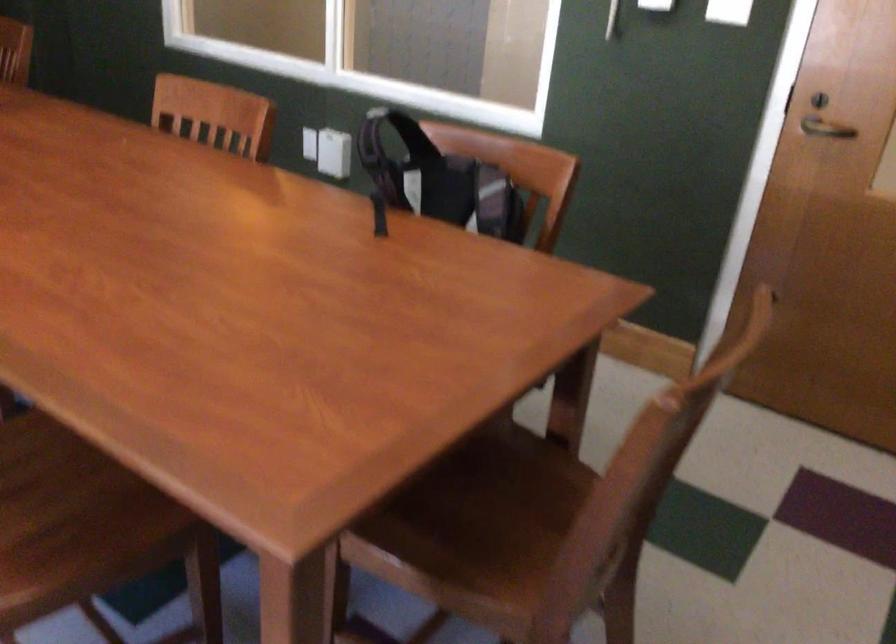
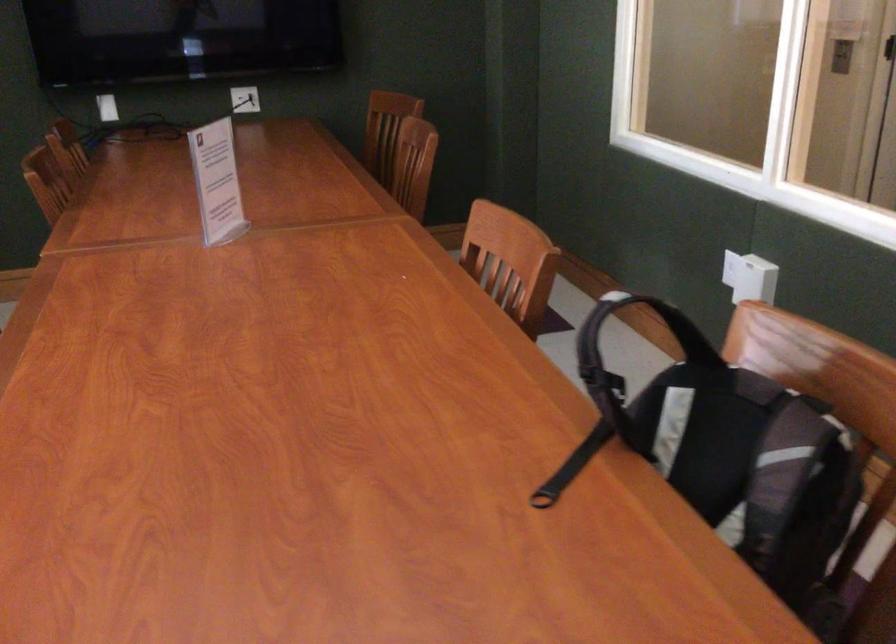
The point at (216, 122) is marked in the first image. Where is the corresponding point in the second image?

(510, 261)